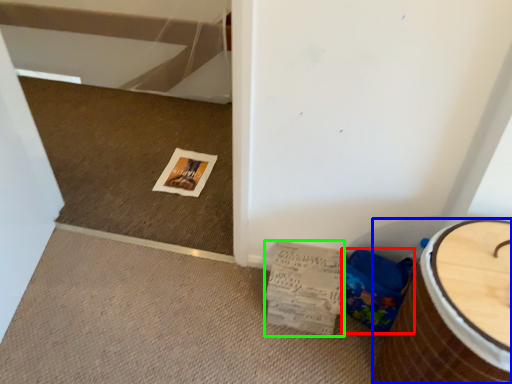
Question: Considering the real-world distances, which object is closest to potty (highlighted by a red box)? furniture (highlighted by a blue box) or magazine (highlighted by a green box).

Choices:
 (A) furniture
 (B) magazine

Answer: (B)